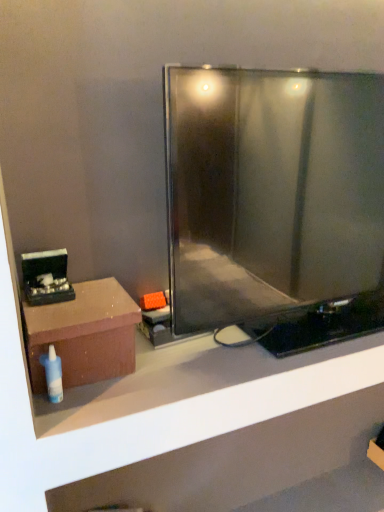
The height and width of the screenshot is (512, 384). In order to click on free space above brown matte shelf at lower left (from a real-world perspective) in this screenshot , I will do `click(218, 356)`.